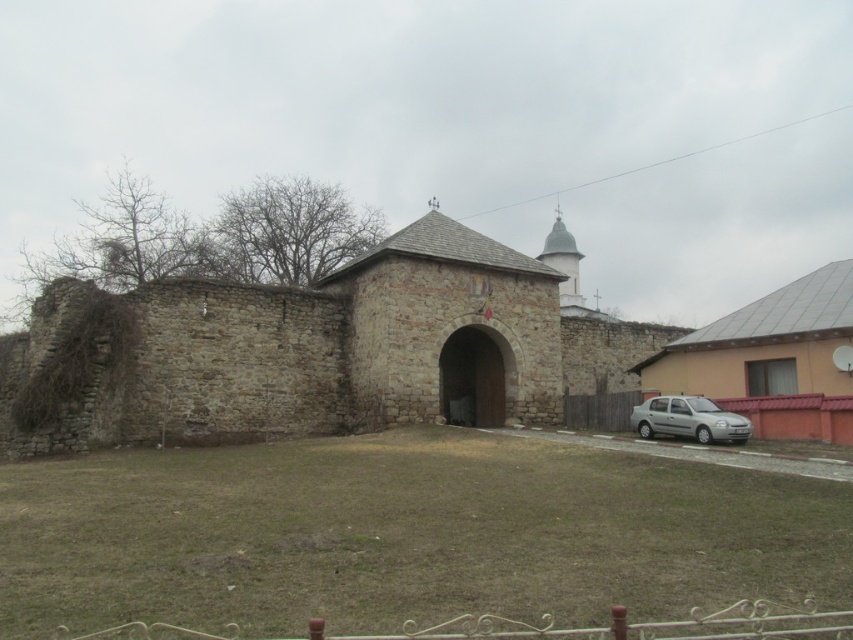
Can you confirm if white wrought iron fence at lower center is wider than wooden fence at lower right?

Indeed, white wrought iron fence at lower center has a greater width compared to wooden fence at lower right.

Can you confirm if white wrought iron fence at lower center is smaller than wooden fence at lower right?

Yes.

The image size is (853, 640). In order to click on white wrought iron fence at lower center in this screenshot , I will do `click(630, 627)`.

Does rustic stone church at center have a smaller size compared to white wrought iron fence at lower center?

No.

Is point (256, 419) positioned in front of point (119, 636)?

No, (256, 419) is behind (119, 636).

At what (x,y) coordinates should I click in order to perform the action: click on rustic stone church at center. Please return your answer as a coordinate pair (x, y). Looking at the image, I should click on (317, 348).

Describe the element at coordinates (689, 419) in the screenshot. I see `silver metallic car at lower right` at that location.

In the scene shown: Between silver metallic car at lower right and wooden fence at lower right, which one appears on the left side from the viewer's perspective?

Positioned to the left is wooden fence at lower right.

Identify the location of silver metallic car at lower right. point(689,419).